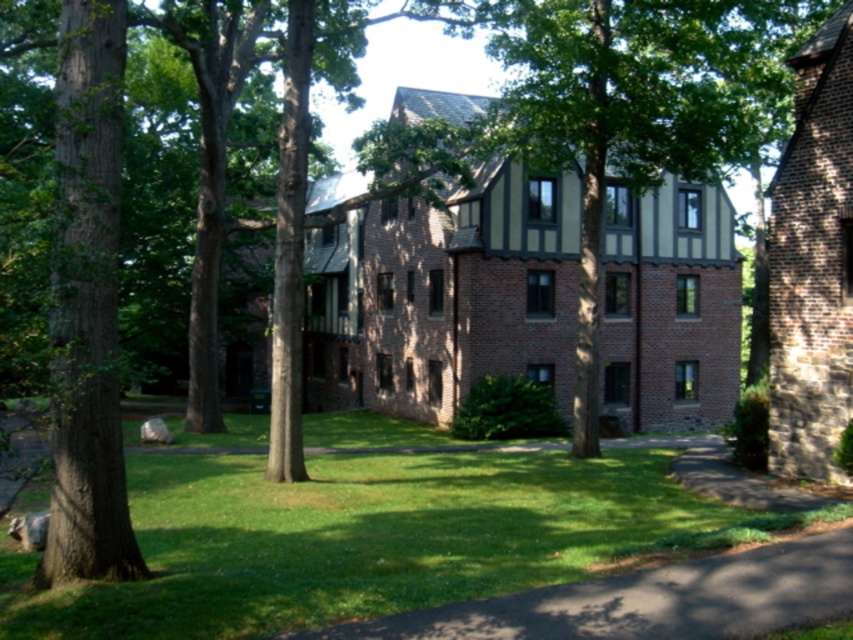
Question: Is green grass at center to the left of green grass at lower center from the viewer's perspective?

Choices:
 (A) yes
 (B) no

Answer: (A)

Question: Which point is closer to the camera?

Choices:
 (A) (247, 572)
 (B) (672, 564)

Answer: (B)

Question: Is green grass at center to the right of green grass at lower center from the viewer's perspective?

Choices:
 (A) no
 (B) yes

Answer: (A)

Question: In this image, where is green grass at center located relative to green grass at lower center?

Choices:
 (A) below
 (B) above

Answer: (A)

Question: Which of the following is the farthest from the observer?

Choices:
 (A) (99, 600)
 (B) (608, 588)

Answer: (B)

Question: Among these objects, which one is farthest from the camera?

Choices:
 (A) green grass at lower center
 (B) green grass at center

Answer: (B)